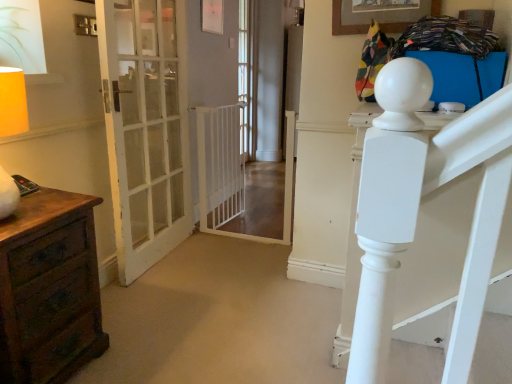
I want to click on vacant space underneath white glass door at left (from a real-world perspective), so click(160, 257).